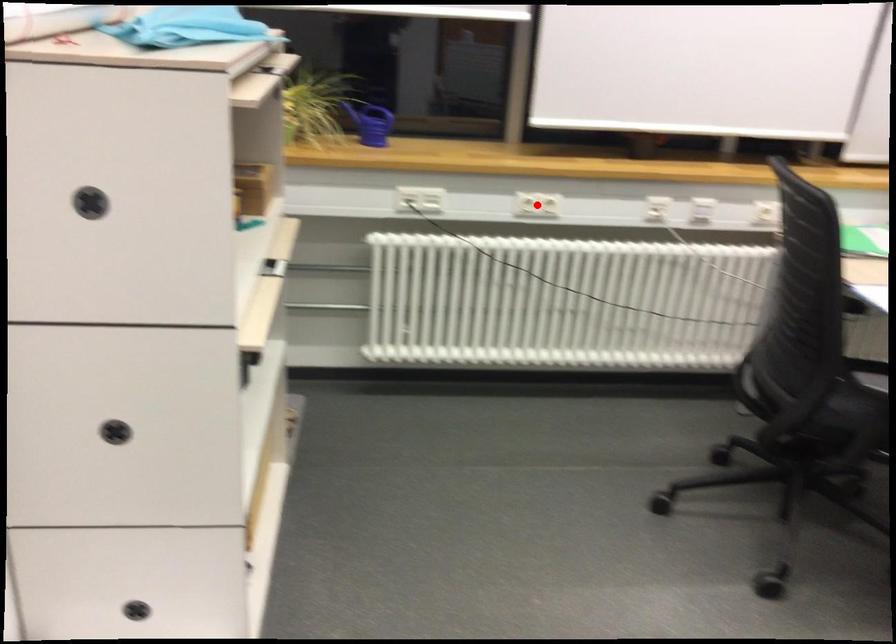
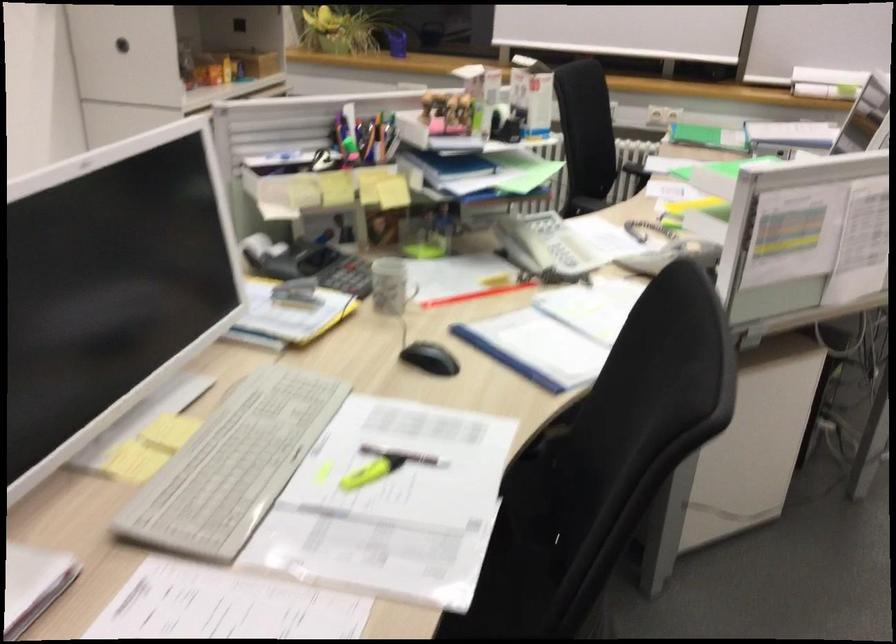
Question: I am providing you with two images of the same scene from different viewpoints. A red point is marked on the first image. Can you still see the location of the red point in image 2?

Choices:
 (A) Yes
 (B) No

Answer: (B)